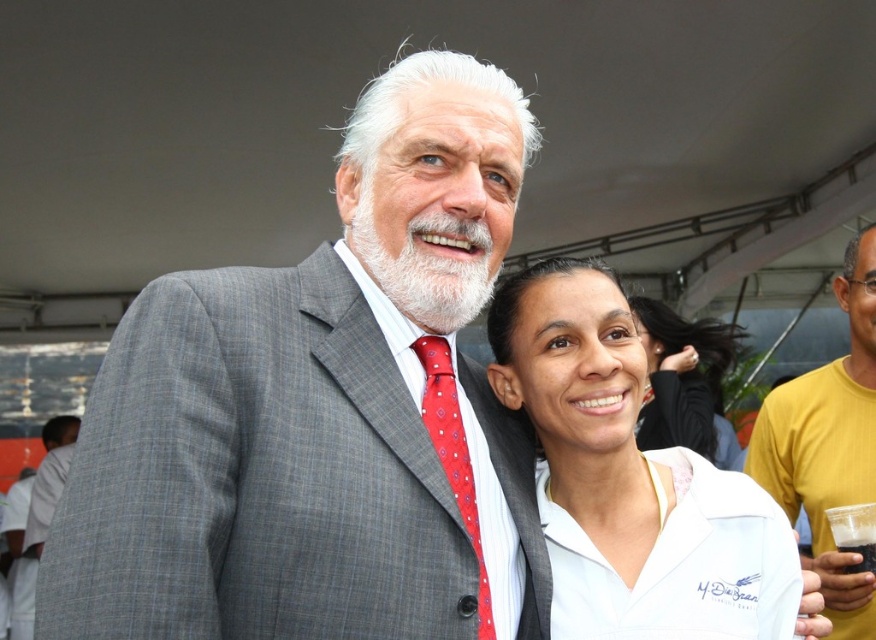
You are a photographer at a social event and need to ensure that the gray textured suit at center and the red silk tie at center are both visible in the photo. Which object will require more space in the frame to capture its full width?

The gray textured suit at center requires more space in the frame to capture its full width because its width surpasses that of the red silk tie at center.

You are a photographer at a social event and notice the gray textured suit at center and the red silk tie at center. Which clothing item is closer to your camera lens?

The gray textured suit at center is positioned over the red silk tie at center, so the gray textured suit at center is closer to the camera lens.

You are organizing a photo shoot and need to ensure that the white cotton shirt at center and the red silk tie at center are visible in the frame. Which object should you focus on to ensure both are in focus, considering their sizes?

The white cotton shirt at center has a larger size compared to the red silk tie at center, so focusing on the larger object, the white cotton shirt at center, will help ensure both are in focus.